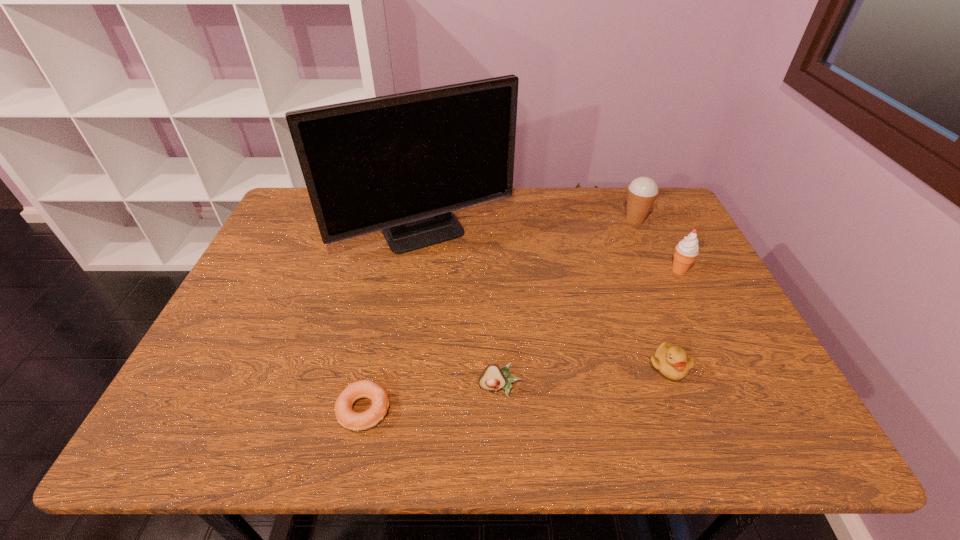
At what (x,y) coordinates should I click in order to perform the action: click on empty space between the bagel and the third shortest object. Please return your answer as a coordinate pair (x, y). The image size is (960, 540). Looking at the image, I should click on click(432, 399).

You are a GUI agent. You are given a task and a screenshot of the screen. Output one action in this format:
    pyautogui.click(x=<x>, y=<y>)
    Task: Click on the unoccupied position between the duckling and the nearer icecream
    
    Given the screenshot: What is the action you would take?
    pyautogui.click(x=674, y=318)

Find the location of `empty space that is in between the duckling and the farther icecream`. empty space that is in between the duckling and the farther icecream is located at coordinates (652, 293).

The height and width of the screenshot is (540, 960). I want to click on vacant region between the farther icecream and the shortest object, so click(499, 315).

Locate an element on the screen. blank region between the farther icecream and the nearer icecream is located at coordinates (657, 245).

Identify the location of vacant area that lies between the fifth tallest object and the farther icecream. The width and height of the screenshot is (960, 540). (652, 293).

Locate an element on the screen. vacant space that's between the computer monitor and the farther icecream is located at coordinates (530, 227).

Locate an element on the screen. The image size is (960, 540). free spot between the shortest object and the tallest object is located at coordinates (395, 322).

At what (x,y) coordinates should I click in order to perform the action: click on unoccupied area between the shortest object and the computer monitor. Please return your answer as a coordinate pair (x, y). The width and height of the screenshot is (960, 540). Looking at the image, I should click on (395, 322).

What are the coordinates of `free space between the nearer icecream and the fifth tallest object` in the screenshot? It's located at (674, 318).